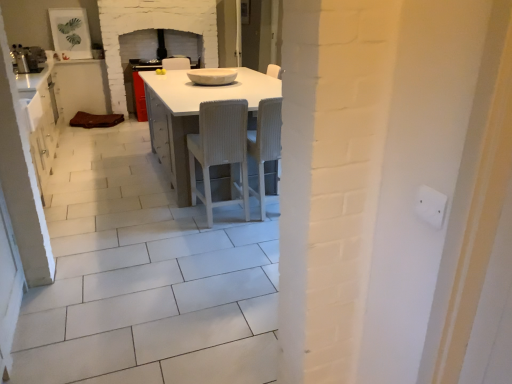
Question: Considering the relative sizes of white glossy table at center and white textured chair at center, which appears as the first chair when viewed from the right, in the image provided, is white glossy table at center bigger than white textured chair at center, which appears as the first chair when viewed from the right,?

Choices:
 (A) no
 (B) yes

Answer: (B)

Question: Is white glossy table at center in contact with white textured chair at center, the second chair when ordered from left to right?

Choices:
 (A) yes
 (B) no

Answer: (B)

Question: Is white glossy table at center facing away from white textured chair at center, which appears as the first chair when viewed from the right?

Choices:
 (A) no
 (B) yes

Answer: (A)

Question: Can you confirm if white glossy table at center is taller than white textured chair at center, the second chair when ordered from left to right?

Choices:
 (A) no
 (B) yes

Answer: (A)

Question: Considering the relative positions of white glossy table at center and white textured chair at center, the second chair when ordered from left to right, in the image provided, is white glossy table at center to the left of white textured chair at center, the second chair when ordered from left to right, from the viewer's perspective?

Choices:
 (A) no
 (B) yes

Answer: (B)

Question: Is white ribbed wood chair at center, which is the 2th chair from right to left, in front of or behind brown leather cushion at left in the image?

Choices:
 (A) behind
 (B) front

Answer: (B)

Question: From the image's perspective, relative to brown leather cushion at left, is white ribbed wood chair at center, which is the 2th chair from right to left, above or below?

Choices:
 (A) above
 (B) below

Answer: (B)

Question: Is point (210, 216) closer or farther from the camera than point (91, 104)?

Choices:
 (A) farther
 (B) closer

Answer: (B)

Question: Would you say white ribbed wood chair at center, which is the first chair in left-to-right order, is to the left or to the right of brown leather cushion at left in the picture?

Choices:
 (A) left
 (B) right

Answer: (B)

Question: Is white ribbed wood chair at center, which is the first chair in left-to-right order, in front of or behind white glossy bowl at center in the image?

Choices:
 (A) behind
 (B) front

Answer: (B)

Question: Does point (236, 117) appear closer or farther from the camera than point (209, 82)?

Choices:
 (A) farther
 (B) closer

Answer: (B)

Question: Which is correct: white ribbed wood chair at center, which is the 2th chair from right to left, is inside white glossy bowl at center, or outside of it?

Choices:
 (A) outside
 (B) inside

Answer: (A)

Question: From a real-world perspective, is white ribbed wood chair at center, which is the first chair in left-to-right order, above or below white glossy bowl at center?

Choices:
 (A) above
 (B) below

Answer: (B)

Question: In the image, is white glossy bowl at center positioned in front of or behind white ribbed wood chair at center, which is the first chair in left-to-right order?

Choices:
 (A) front
 (B) behind

Answer: (B)

Question: Looking at their shapes, would you say white glossy bowl at center is wider or thinner than white ribbed wood chair at center, which is the first chair in left-to-right order?

Choices:
 (A) wide
 (B) thin

Answer: (A)